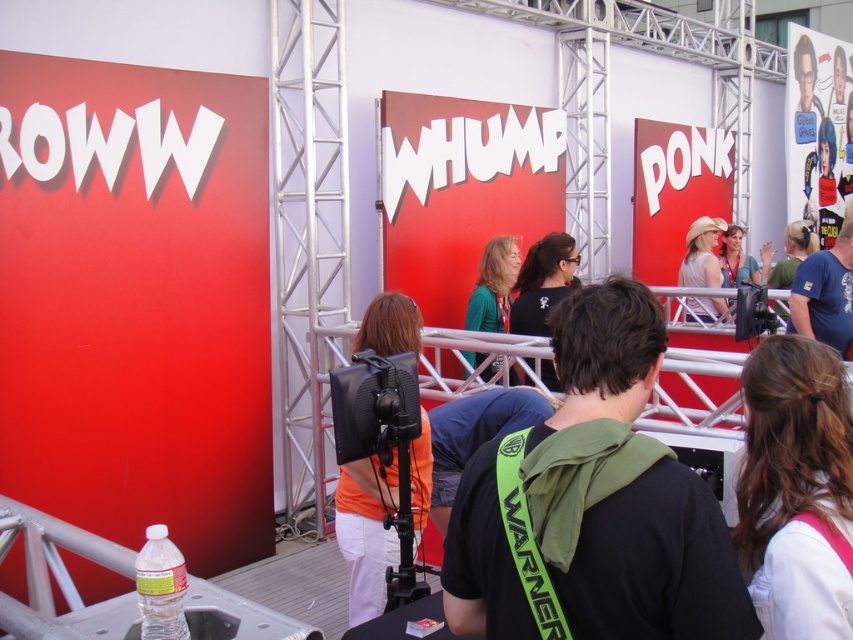
From the picture: You are standing at the center of the image and want to place a new decorative item exactly where the light beige cowboy hat at center is currently located. What are the coordinates you should aim for?

The coordinates for the light beige cowboy hat at center are at point [701,253], so you should aim for those coordinates.

You are standing at the event and want to move from the point at coordinates point (827, 310) to the point at coordinates point (498, 260). Can you walk directly between them without any obstacles?

Yes, you can walk directly between point (827, 310) and point (498, 260) because point (827, 310) is in front of point (498, 260), meaning there is a clear path between them.